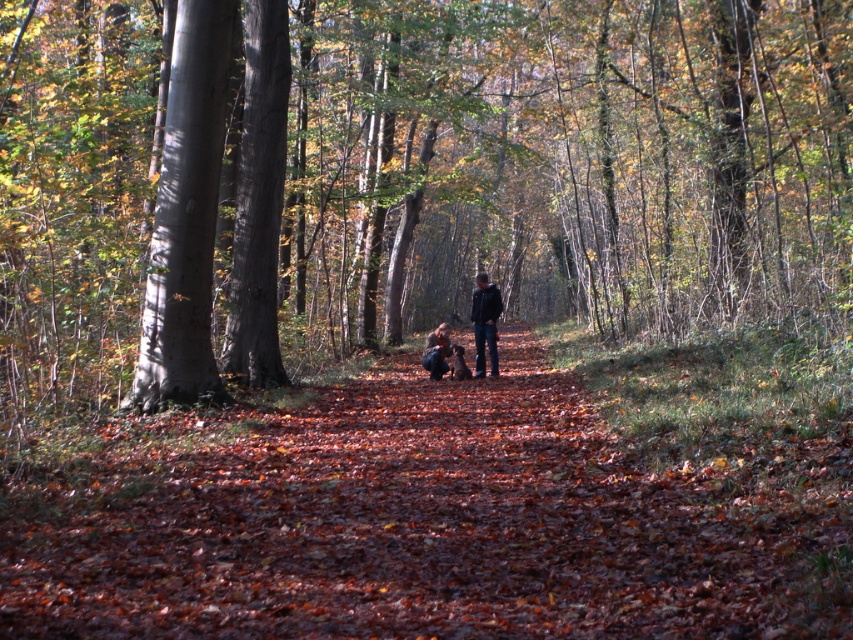
You are a hiker planning to set up a tent between the smooth bark tree at center and the dark blue jeans at center. The tent requires a minimum of 10 meters of space. Can you determine if there is enough space between them?

The distance between the smooth bark tree at center and the dark blue jeans at center is 13.14 meters, which exceeds the required 10 meters. Therefore, there is sufficient space to set up the tent between them.

You are standing on the path in the autumn forest scene. You see a dark blue jacket at center and a dark blue jeans at center. Which clothing item is positioned more to the right?

The dark blue jacket at center is positioned more to the right than the dark blue jeans at center.

You are standing at the point marked as point (457, 502) in the image. What is the name of the feature located exactly at that coordinate?

The feature located at point (457, 502) is the brown leafy forest path at center.